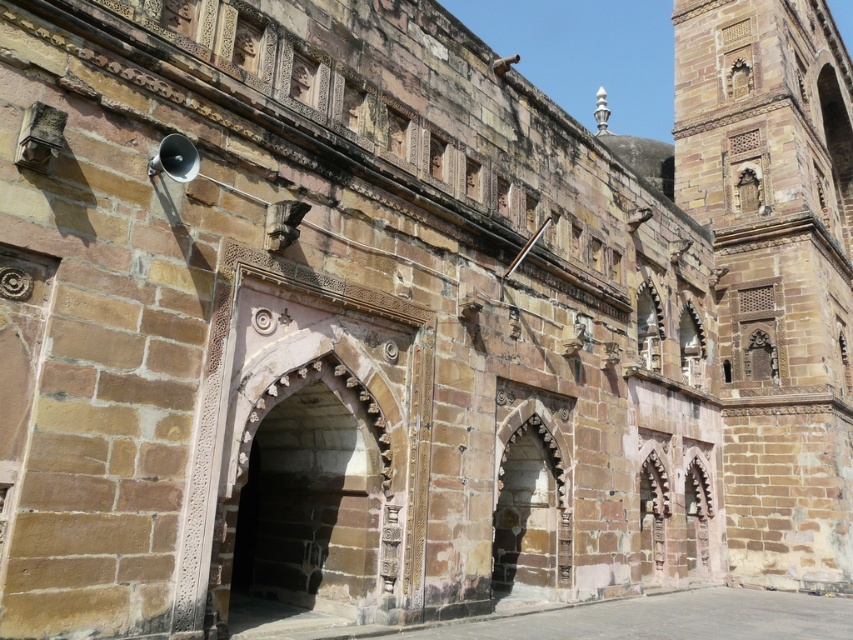
Who is taller, brown stone tower at right or stone textured archway at center?

With more height is brown stone tower at right.

Between point (729, 100) and point (540, 419), which one is positioned behind?

The point (729, 100) is behind.

Locate an element on the screen. The image size is (853, 640). brown stone tower at right is located at coordinates (775, 273).

Where is `brown stone tower at right`? brown stone tower at right is located at coordinates (775, 273).